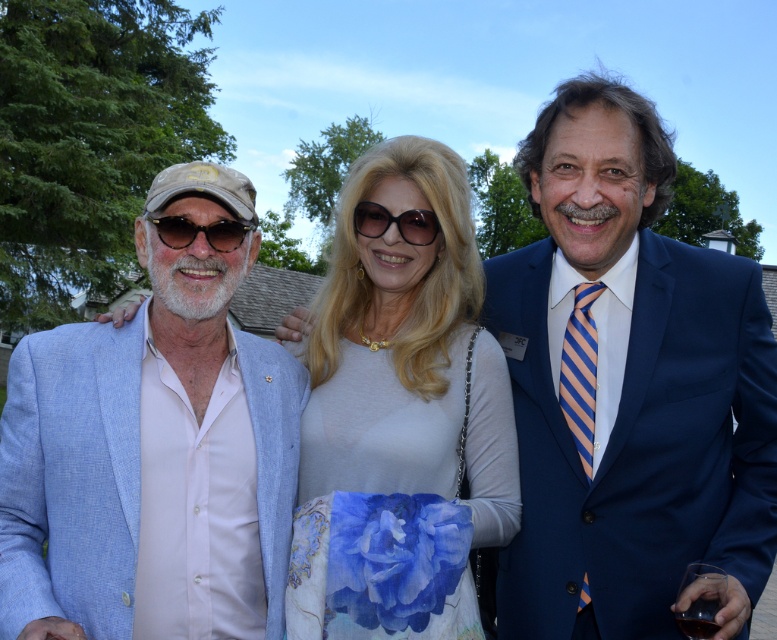
You are a photographer trying to capture a clear shot of the transparent glass at center and the matte black sunglasses at left. Since both are reflective, you need to adjust your angle to minimize glare. Which object should you adjust your angle for first, considering their reflective surfaces?

The transparent glass at center has a greater height compared to matte black sunglasses at left, so you should adjust your angle for the transparent glass at center first to account for its larger reflective surface area.

You are a photographer at the event and need to adjust your camera focus. Which object is positioned lower in the scene, the transparent glass at center or the matte black sunglasses at left?

The transparent glass at center is positioned lower than the matte black sunglasses at left according to the description.